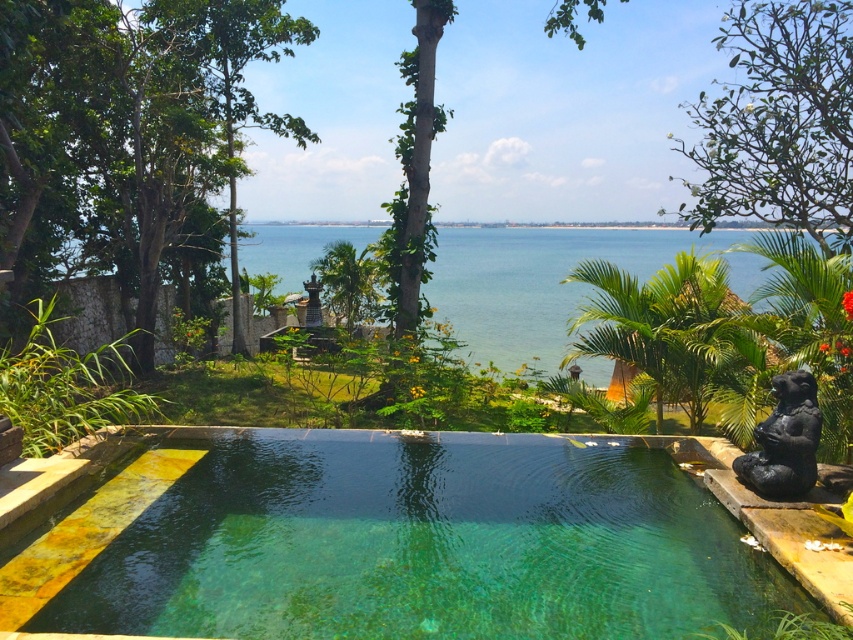
Question: Does clear glass pool at center appear on the right side of clear blue water at center?

Choices:
 (A) no
 (B) yes

Answer: (A)

Question: Which point appears closest to the camera in this image?

Choices:
 (A) (379, 232)
 (B) (782, 493)

Answer: (B)

Question: Considering the relative positions of clear glass pool at center and clear blue water at center in the image provided, where is clear glass pool at center located with respect to clear blue water at center?

Choices:
 (A) below
 (B) above

Answer: (A)

Question: Does clear glass pool at center have a smaller size compared to black stone statue at right?

Choices:
 (A) yes
 (B) no

Answer: (B)

Question: Which object is the farthest from the clear blue water at center?

Choices:
 (A) clear glass pool at center
 (B) black stone statue at right

Answer: (A)

Question: Among these points, which one is farthest from the camera?

Choices:
 (A) (280, 493)
 (B) (438, 232)

Answer: (B)